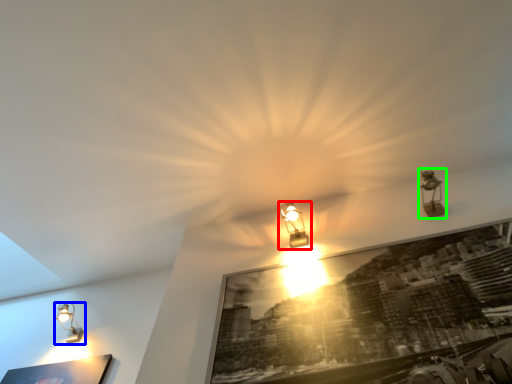
Question: Based on their relative distances, which object is farther from lamp (highlighted by a red box)? Choose from lamp (highlighted by a blue box) and lamp (highlighted by a green box).

Choices:
 (A) lamp
 (B) lamp

Answer: (A)